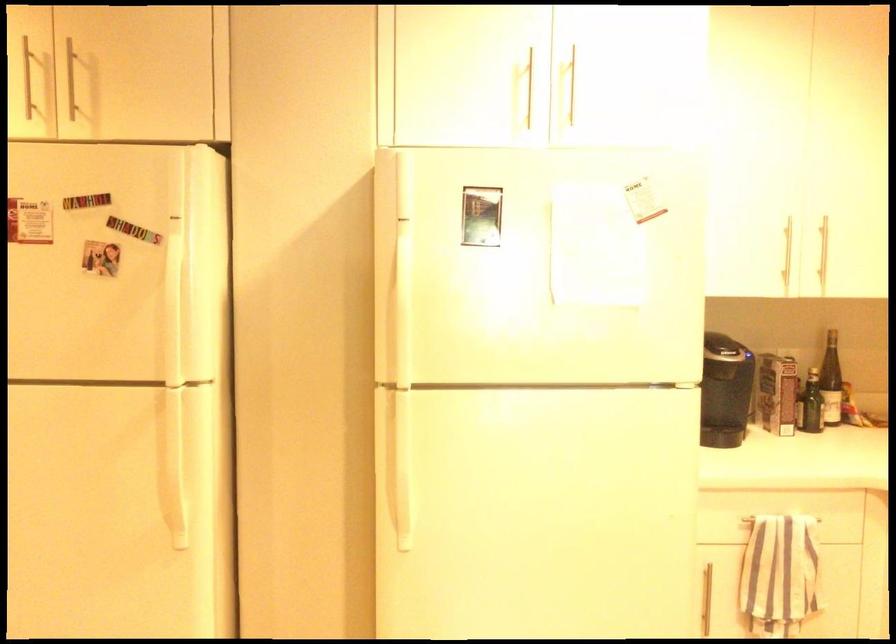
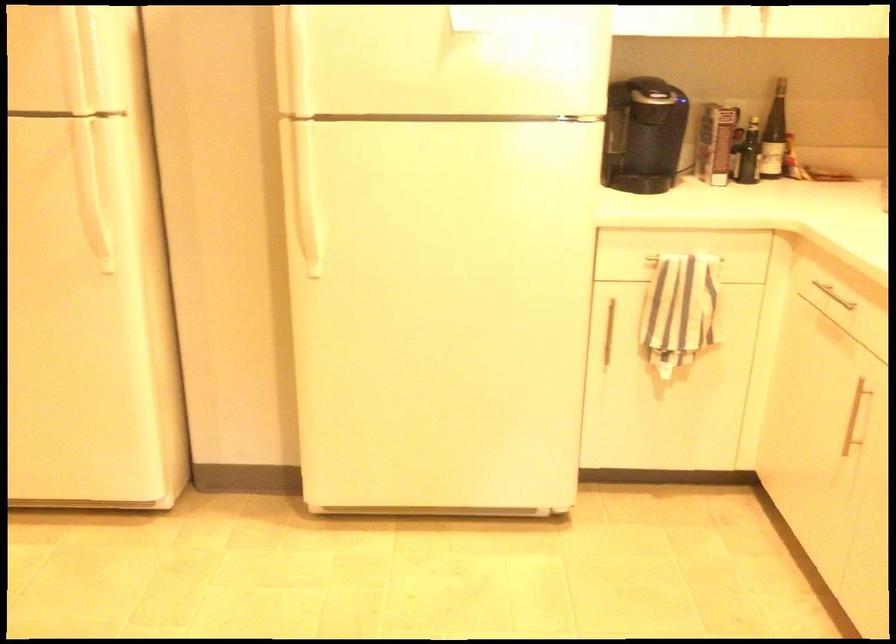
Question: The first image is from the beginning of the video and the second image is from the end. How did the camera likely rotate when shooting the video?

Choices:
 (A) Left
 (B) Right
 (C) Up
 (D) Down

Answer: (D)